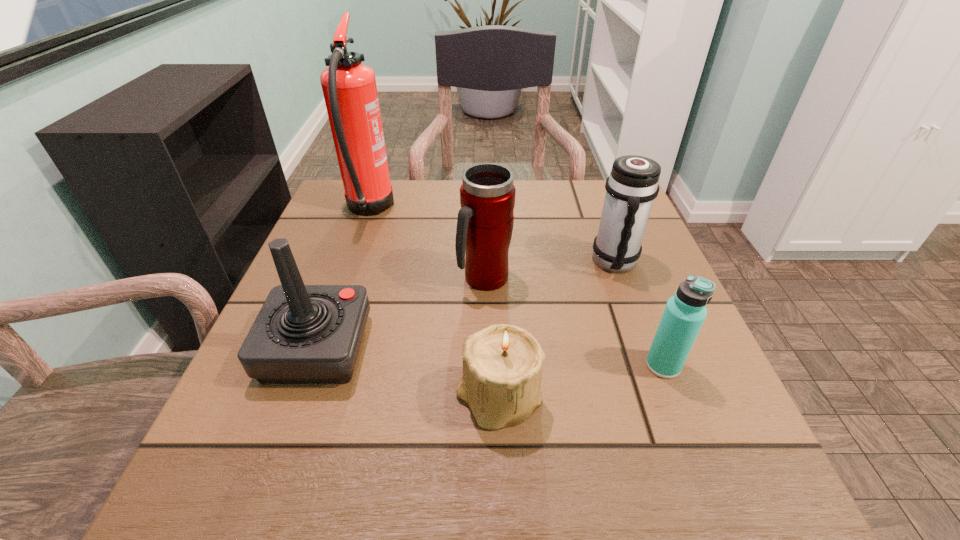
Locate an element on the screen. The width and height of the screenshot is (960, 540). vacant space located on the right of the candle_holder is located at coordinates (600, 398).

Image resolution: width=960 pixels, height=540 pixels. I want to click on object that is at the far edge, so click(349, 88).

Where is `fire extinguisher present at the left edge`? Image resolution: width=960 pixels, height=540 pixels. fire extinguisher present at the left edge is located at coordinates (349, 88).

Where is `joystick located at the left edge`? joystick located at the left edge is located at coordinates (304, 334).

You are a GUI agent. You are given a task and a screenshot of the screen. Output one action in this format:
    pyautogui.click(x=<x>, y=<y>)
    Task: Click on the object located at the far left corner
    
    Given the screenshot: What is the action you would take?
    pyautogui.click(x=349, y=88)

The image size is (960, 540). I want to click on vacant space at the far edge of the desktop, so click(x=452, y=185).

Identify the location of vacant region at the near edge of the desktop. This screenshot has width=960, height=540. 635,471.

Where is `free space at the left edge of the desktop`? free space at the left edge of the desktop is located at coordinates (370, 261).

Where is `vacant space at the right edge`? The width and height of the screenshot is (960, 540). vacant space at the right edge is located at coordinates (589, 256).

The image size is (960, 540). Identify the location of vacant region at the near left corner of the desktop. (239, 451).